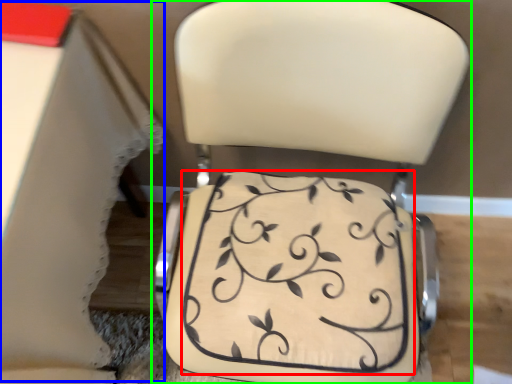
Question: Estimate the real-world distances between objects in this image. Which object is closer to wedding cake (highlighted by a red box), table (highlighted by a blue box) or chair (highlighted by a green box)?

Choices:
 (A) table
 (B) chair

Answer: (B)